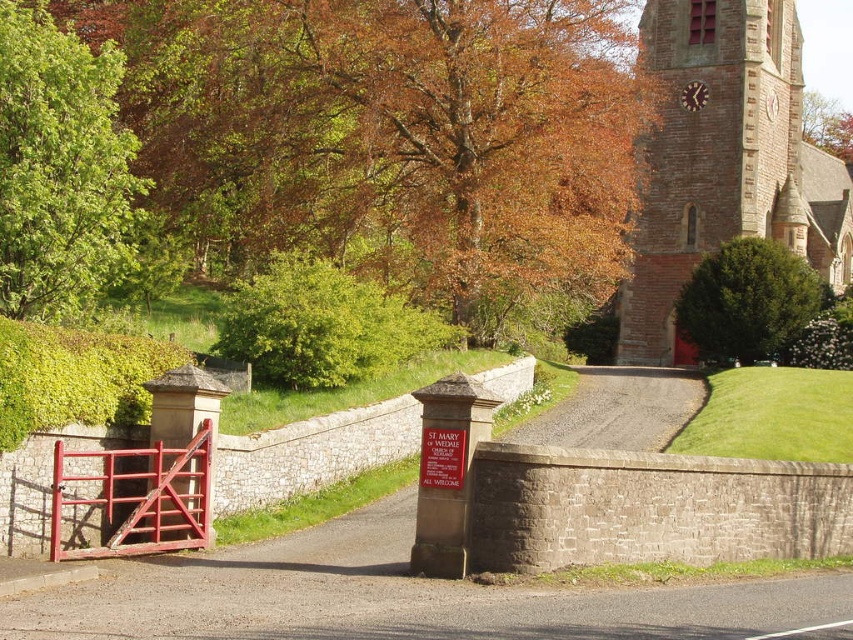
Can you confirm if green leafy tree at upper left is bigger than green leafy bush at upper right?

Indeed, green leafy tree at upper left has a larger size compared to green leafy bush at upper right.

Does green leafy tree at upper left appear on the left side of green leafy bush at upper right?

Indeed, green leafy tree at upper left is positioned on the left side of green leafy bush at upper right.

This screenshot has height=640, width=853. Find the location of `green leafy tree at upper left`. green leafy tree at upper left is located at coordinates (61, 168).

Which is below, brown stone church at upper right or brown textured tree at upper right?

brown stone church at upper right is lower down.

Consider the image. Which of these two, brown stone church at upper right or brown textured tree at upper right, stands shorter?

brown textured tree at upper right

This screenshot has width=853, height=640. In order to click on brown stone church at upper right in this screenshot , I will do `click(724, 161)`.

Locate an element on the screen. The height and width of the screenshot is (640, 853). brown stone church at upper right is located at coordinates (724, 161).

Can you confirm if green leafy tree at upper left is shorter than brown textured tree at upper right?

No, green leafy tree at upper left is not shorter than brown textured tree at upper right.

Between point (65, 268) and point (821, 125), which one is positioned behind?

The point (821, 125) is behind.

Which is behind, point (39, 230) or point (849, 150)?

Point (849, 150)

At what (x,y) coordinates should I click in order to perform the action: click on green leafy tree at upper left. Please return your answer as a coordinate pair (x, y). This screenshot has height=640, width=853. Looking at the image, I should click on (61, 168).